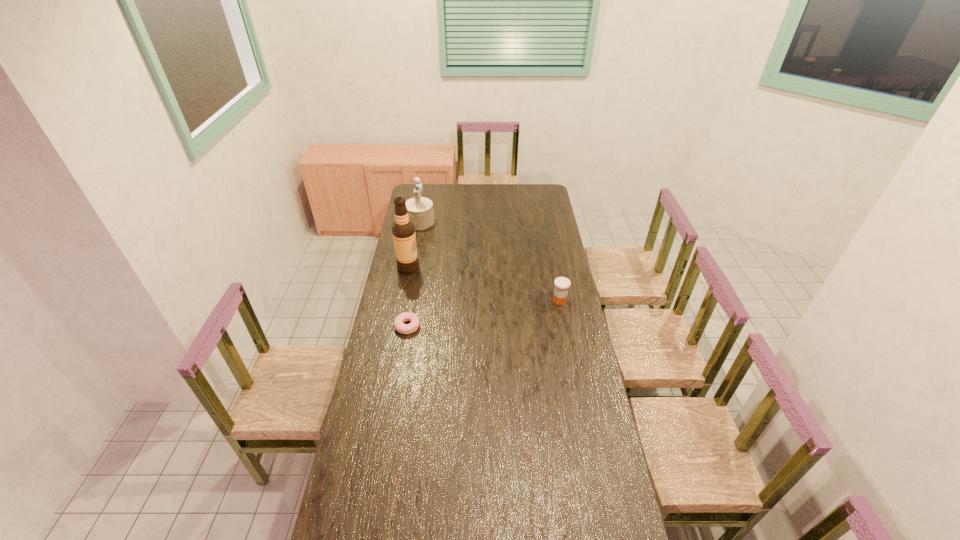
In order to click on vacant space that is in between the medicine and the nearest object in this screenshot , I will do `click(484, 313)`.

Locate an element on the screen. This screenshot has height=540, width=960. vacant region between the second nearest object and the third shortest object is located at coordinates (490, 261).

Where is `empty space between the shortest object and the figurine`? The image size is (960, 540). empty space between the shortest object and the figurine is located at coordinates (414, 274).

Find the location of a particular element. The height and width of the screenshot is (540, 960). empty space that is in between the tallest object and the nearest object is located at coordinates (408, 297).

Identify which object is the second closest to the alcohol. Please provide its 2D coordinates. Your answer should be formatted as a tuple, i.e. [(x, y)], where the tuple contains the x and y coordinates of a point satisfying the conditions above.

[(399, 325)]

Where is `the third closest object to the doughnut`? the third closest object to the doughnut is located at coordinates (420, 209).

Where is `vacant area that satisfies the following two spatial constraints: 1. on the back side of the shortest object; 2. on the label of the second nearest object`? vacant area that satisfies the following two spatial constraints: 1. on the back side of the shortest object; 2. on the label of the second nearest object is located at coordinates tap(412, 301).

This screenshot has width=960, height=540. I want to click on free space in the image that satisfies the following two spatial constraints: 1. on the back side of the shortest object; 2. on the label of the medicine, so click(412, 301).

Identify the location of vacant space that satisfies the following two spatial constraints: 1. on the front side of the doughnut; 2. on the right side of the third nearest object. (397, 326).